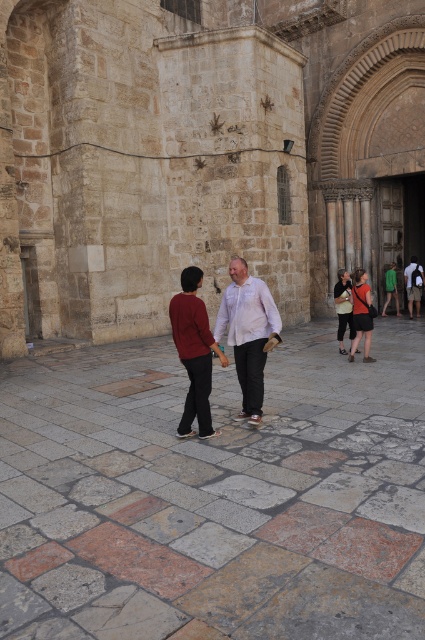
Question: Can you confirm if white matte shirt at center is positioned below matte red sweater at center?

Choices:
 (A) yes
 (B) no

Answer: (B)

Question: Considering the relative positions of dark gray fabric bag at center and green fabric backpack at right in the image provided, where is dark gray fabric bag at center located with respect to green fabric backpack at right?

Choices:
 (A) right
 (B) left

Answer: (B)

Question: Which point is farther to the camera?

Choices:
 (A) dark gray fabric bag at center
 (B) green fabric backpack at right
 (C) green fabric shirt at right

Answer: (C)

Question: Considering the real-world distances, which object is closest to the white matte shirt at center?

Choices:
 (A) green fabric shirt at right
 (B) matte red sweater at center

Answer: (B)

Question: Can you confirm if stone paved courtyard at center is positioned above green fabric backpack at right?

Choices:
 (A) yes
 (B) no

Answer: (B)

Question: Which point is closer to the camera taking this photo?

Choices:
 (A) (x=371, y=320)
 (B) (x=248, y=305)
 (C) (x=393, y=289)

Answer: (B)